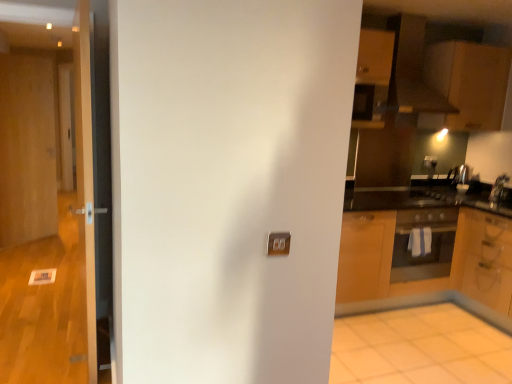
This screenshot has height=384, width=512. Describe the element at coordinates (27, 149) in the screenshot. I see `wooden door at left, which is the 3th door from right to left` at that location.

The height and width of the screenshot is (384, 512). Describe the element at coordinates (419, 348) in the screenshot. I see `white glossy tile at lower right` at that location.

This screenshot has height=384, width=512. I want to click on wooden cabinet at right, which is the 1th cabinetry in bottom-to-top order, so click(x=483, y=259).

Image resolution: width=512 pixels, height=384 pixels. In order to click on matte wood cabinetry at upper right, arranged as the second cabinetry when ordered from the bottom in this screenshot , I will do `click(470, 82)`.

In the image, there is a matte wood cabinetry at upper right, which appears as the first cabinetry when viewed from the top. Identify the location of plain below it (from a real-world perspective). (419, 348).

Is white glossy tile at lower right taller than matte wood cabinetry at upper right, which appears as the first cabinetry when viewed from the top?

In fact, white glossy tile at lower right may be shorter than matte wood cabinetry at upper right, which appears as the first cabinetry when viewed from the top.

Which object is further away from the camera, white glossy tile at lower right or matte wood cabinetry at upper right, arranged as the second cabinetry when ordered from the bottom?

Answer: matte wood cabinetry at upper right, arranged as the second cabinetry when ordered from the bottom, is further away from the camera.

From a real-world perspective, is matte brown exhaust hood at upper right on top of white glossy door at left, marked as the 3th door in a back-to-front arrangement?

Yes, from a real-world perspective, matte brown exhaust hood at upper right is above white glossy door at left, marked as the 3th door in a back-to-front arrangement.

Would you say matte brown exhaust hood at upper right is inside or outside white glossy door at left, marked as the 3th door in a back-to-front arrangement?

matte brown exhaust hood at upper right exists outside the volume of white glossy door at left, marked as the 3th door in a back-to-front arrangement.

Locate an element on the screen. exhaust hood above the white glossy door at left, which ranks as the third door in left-to-right order (from a real-world perspective) is located at coordinates (411, 70).

From the image's perspective, which one is positioned higher, matte brown exhaust hood at upper right or white glossy door at left, which ranks as the third door in left-to-right order?

From the image's view, matte brown exhaust hood at upper right is above.

From a real-world perspective, who is located higher, white glossy door at left, which ranks as the third door in left-to-right order, or matte brown exhaust hood at upper right?

matte brown exhaust hood at upper right, from a real-world perspective.

From the image's perspective, which one is positioned lower, white glossy door at left, the first door viewed from the front, or matte brown exhaust hood at upper right?

white glossy door at left, the first door viewed from the front, is shown below in the image.

Which is more to the left, white glossy door at left, the first door viewed from the front, or matte brown exhaust hood at upper right?

white glossy door at left, the first door viewed from the front.

Is white glossy door at left, which appears as the first door when viewed from the right, wider than matte brown exhaust hood at upper right?

Incorrect, the width of white glossy door at left, which appears as the first door when viewed from the right, does not surpass that of matte brown exhaust hood at upper right.

From the image's perspective, which is below, white glossy door at left, the first door viewed from the front, or wooden door at left, acting as the first door starting from the left?

From the image's view, white glossy door at left, the first door viewed from the front, is below.

Is white glossy door at left, the first door viewed from the front, oriented away from wooden door at left, which is the 3th door from right to left?

white glossy door at left, the first door viewed from the front, is not turned away from wooden door at left, which is the 3th door from right to left.

Is white glossy door at left, marked as the 3th door in a back-to-front arrangement, shorter than wooden door at left, acting as the first door starting from the left?

Indeed, white glossy door at left, marked as the 3th door in a back-to-front arrangement, has a lesser height compared to wooden door at left, acting as the first door starting from the left.

From the image's perspective, which object appears higher, wooden door at left, the 1th door from the back, or white glossy door at left, marked as the 3th door in a back-to-front arrangement?

wooden door at left, the 1th door from the back, appears higher in the image.

Between wooden door at left, acting as the first door starting from the left, and white glossy door at left, which ranks as the third door in left-to-right order, which one has larger width?

Wider between the two is white glossy door at left, which ranks as the third door in left-to-right order.

Can you see wooden door at left, acting as the first door starting from the left, touching white glossy door at left, the first door viewed from the front?

No, wooden door at left, acting as the first door starting from the left, is not touching white glossy door at left, the first door viewed from the front.

Between wooden door at left, which ranks as the third door in front-to-back order, and white glossy door at left, marked as the 3th door in a back-to-front arrangement, which one appears on the left side from the viewer's perspective?

Positioned to the left is wooden door at left, which ranks as the third door in front-to-back order.

In the scene shown: How many degrees apart are the facing directions of wooden cabinet at right, which appears as the 2th cabinetry when viewed from the top, and matte brown exhaust hood at upper right?

They differ by 88.7 degrees in their facing directions.

Are wooden cabinet at right, which appears as the 2th cabinetry when viewed from the top, and matte brown exhaust hood at upper right far apart?

Absolutely, wooden cabinet at right, which appears as the 2th cabinetry when viewed from the top, is distant from matte brown exhaust hood at upper right.

Is point (496, 216) closer or farther from the camera than point (396, 83)?

Point (496, 216) is closer to the camera than point (396, 83).

Is wooden cabinet at right, which appears as the 2th cabinetry when viewed from the top, turned away from matte brown exhaust hood at upper right?

No, matte brown exhaust hood at upper right is not at the back of wooden cabinet at right, which appears as the 2th cabinetry when viewed from the top.

From a real-world perspective, is white glossy door at left, the first door viewed from the front, physically located above or below white glossy tile at lower right?

white glossy door at left, the first door viewed from the front, is situated higher than white glossy tile at lower right in the real world.

Is white glossy door at left, which appears as the first door when viewed from the right, bigger than white glossy tile at lower right?

Yes, white glossy door at left, which appears as the first door when viewed from the right, is bigger than white glossy tile at lower right.

Are white glossy door at left, the first door viewed from the front, and white glossy tile at lower right located far from each other?

Indeed, white glossy door at left, the first door viewed from the front, is not near white glossy tile at lower right.

From the picture: How different are the orientations of white glossy door at left, which appears as the first door when viewed from the right, and white glossy tile at lower right in degrees?

83.5 degrees.

Where is `plain located in front of the matte wood cabinetry at upper right, which appears as the first cabinetry when viewed from the top`? Image resolution: width=512 pixels, height=384 pixels. plain located in front of the matte wood cabinetry at upper right, which appears as the first cabinetry when viewed from the top is located at coordinates (419, 348).

This screenshot has height=384, width=512. Identify the location of exhaust hood above the white glossy door at left, which appears as the first door when viewed from the right (from the image's perspective). (411, 70).

Based on the photo, which object lies nearer to the anchor point matte black oven at right, wooden door at left, which ranks as the third door in front-to-back order, or wooden door at left, which ranks as the 2th door in back-to-front order?

wooden door at left, which ranks as the 2th door in back-to-front order.

Consider the image. Based on their spatial positions, is wooden door at left, marked as the second door in a front-to-back arrangement, or matte brown exhaust hood at upper right closer to white glossy tile at lower right?

matte brown exhaust hood at upper right lies closer to white glossy tile at lower right than the other object.

From the image, which object appears to be farther from white glossy tile at lower right, matte brown exhaust hood at upper right or wooden door at left, which is the 3th door from right to left?

The object further to white glossy tile at lower right is wooden door at left, which is the 3th door from right to left.

Looking at the image, which one is located closer to wooden cabinet at right, which is the 1th cabinetry in bottom-to-top order, matte wood cabinetry at upper right, arranged as the second cabinetry when ordered from the bottom, or wooden door at left, acting as the first door starting from the left?

Based on the image, matte wood cabinetry at upper right, arranged as the second cabinetry when ordered from the bottom, appears to be nearer to wooden cabinet at right, which is the 1th cabinetry in bottom-to-top order.

Estimate the real-world distances between objects in this image. Which object is further from wooden door at left, the 1th door from the back, wooden door at left, the 2th door positioned from the left, or matte black oven at right?

matte black oven at right is further to wooden door at left, the 1th door from the back.

Which object lies further to the anchor point white glossy door at left, the first door viewed from the front, wooden door at left, marked as the 2th door in a right-to-left arrangement, or matte wood cabinetry at upper right, arranged as the second cabinetry when ordered from the bottom?

Among the two, matte wood cabinetry at upper right, arranged as the second cabinetry when ordered from the bottom, is located further to white glossy door at left, the first door viewed from the front.

From the image, which object appears to be farther from matte black oven at right, matte wood cabinetry at upper right, arranged as the second cabinetry when ordered from the bottom, or matte brown exhaust hood at upper right?

matte brown exhaust hood at upper right.

Considering their positions, is matte brown exhaust hood at upper right positioned further to matte black oven at right than white glossy door at left, the first door viewed from the front?

Based on the image, white glossy door at left, the first door viewed from the front, appears to be further to matte black oven at right.

At what (x,y) coordinates should I click in order to perform the action: click on oven between matte brown exhaust hood at upper right and white glossy tile at lower right in the vertical direction. Please return your answer as a coordinate pair (x, y). Looking at the image, I should click on (423, 244).

You are a GUI agent. You are given a task and a screenshot of the screen. Output one action in this format:
    pyautogui.click(x=<x>, y=<y>)
    Task: Click on the oven between wooden door at left, which ranks as the 2th door in back-to-front order, and wooden cabinet at right, which appears as the 2th cabinetry when viewed from the top, in the horizontal direction
    
    Given the screenshot: What is the action you would take?
    coord(423,244)

I want to click on oven between wooden door at left, marked as the second door in a front-to-back arrangement, and matte wood cabinetry at upper right, arranged as the second cabinetry when ordered from the bottom, in the horizontal direction, so click(423, 244).

Locate an element on the screen. The height and width of the screenshot is (384, 512). cabinetry between wooden door at left, which is the 3th door from right to left, and wooden cabinet at right, which is the 1th cabinetry in bottom-to-top order, from left to right is located at coordinates (470, 82).